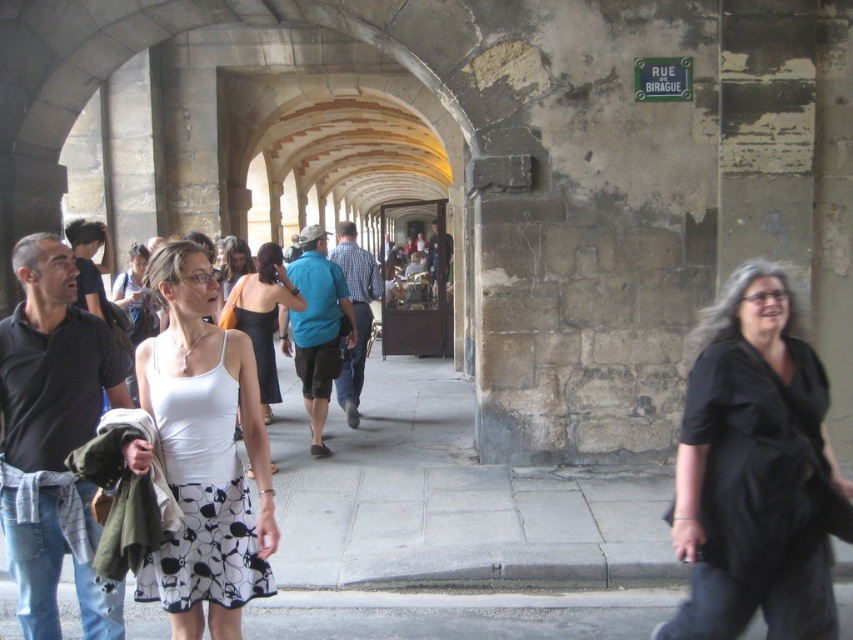
You are a photographer standing at the entrance of the arched passageway. You want to take a photo of the white printed fabric dress at center and the gray concrete pavement at lower center. Which object should you focus on first to ensure both are in sharp focus?

The white printed fabric dress at center is in front of the gray concrete pavement at lower center. To ensure both are in sharp focus, you should focus on the white printed fabric dress at center first since it is closer to the camera.

You are an observer standing at the entrance of the arched passageway. You notice two dresses at the center of the scene. Which dress is closer to you, the white printed fabric dress at center or the white matte dress at center?

The white printed fabric dress at center is closer to you because it is positioned under the white matte dress at center, indicating it is in front.

You are standing at the entrance of the arched passageway and want to locate the white printed fabric dress at center. According to the coordinates provided, in which direction should you look relative to your position?

The white printed fabric dress at center is located at coordinates point (207, 483). Since the x coordinate is 0.756, which is closer to the right side of the image, and the y coordinate 0.244 is closer to the top, you should look towards the upper right direction from your position at the entrance.